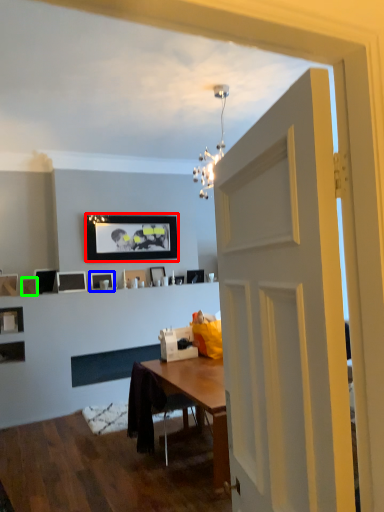
Question: Which is nearer to the picture frame (highlighted by a red box)? picture frame (highlighted by a blue box) or picture frame (highlighted by a green box).

Choices:
 (A) picture frame
 (B) picture frame

Answer: (A)